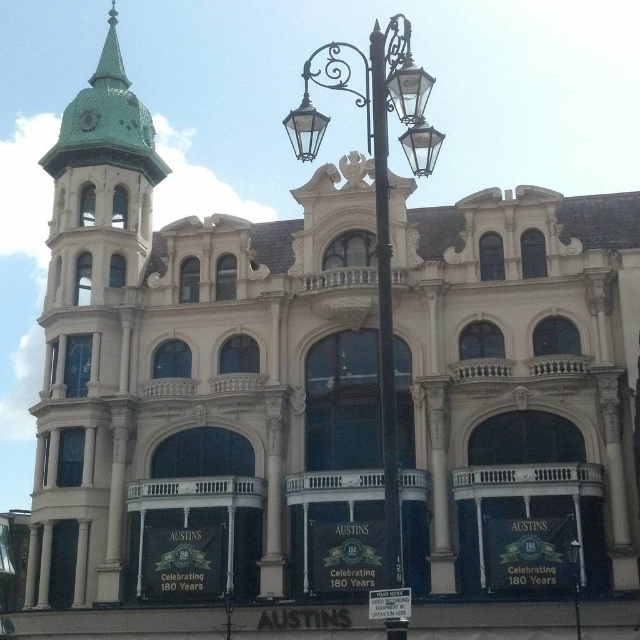
Question: Can you confirm if green painted metal bell tower at left is positioned to the right of polished metal streetlamp at center?

Choices:
 (A) yes
 (B) no

Answer: (B)

Question: Is polished brass street light at center to the right of polished metal streetlamp at center from the viewer's perspective?

Choices:
 (A) yes
 (B) no

Answer: (B)

Question: Does polished metal streetlamp at center have a smaller size compared to green glazed tile spire at upper left?

Choices:
 (A) no
 (B) yes

Answer: (A)

Question: Which object appears closest to the camera in this image?

Choices:
 (A) polished brass street light at center
 (B) green painted metal bell tower at left

Answer: (A)

Question: Among these points, which one is nearest to the camera?

Choices:
 (A) (316, 148)
 (B) (106, 70)
 (C) (109, 365)

Answer: (A)

Question: Which of the following is the closest to the observer?

Choices:
 (A) green glazed tile spire at upper left
 (B) green painted metal bell tower at left
 (C) polished metal streetlamp at center

Answer: (C)